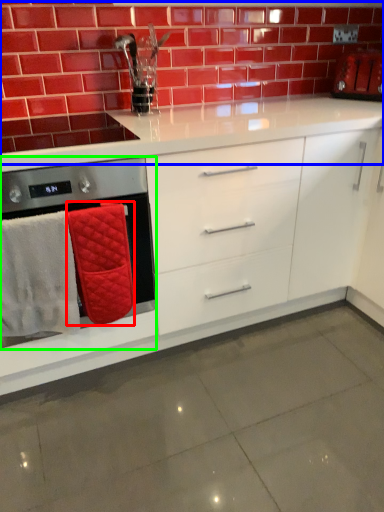
Question: Which is nearer to the bath towel (highlighted by a red box)? brickwork (highlighted by a blue box) or home appliance (highlighted by a green box).

Choices:
 (A) brickwork
 (B) home appliance

Answer: (B)